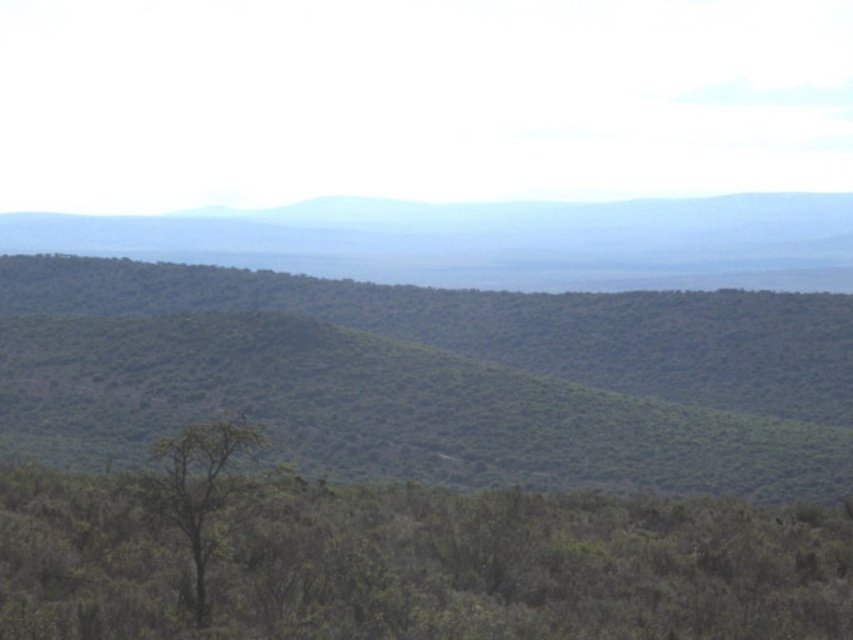
You are standing at the point marked as point (401, 560) in the image. What is the nearest object to you in the scene?

The point (401, 560) is on the green leafy tree at lower center, so the nearest object to you is the green leafy tree at lower center.

You are a hiker planning to take a photo of the green textured hill at center and the green leafy tree at center from a vantage point. Which object should you position closer to the foreground to make both appear in the same frame?

You should position the green leafy tree at center closer to the foreground because it is shorter than the green textured hill at center, allowing both to be captured in the same frame when the shorter tree is nearer to the camera.